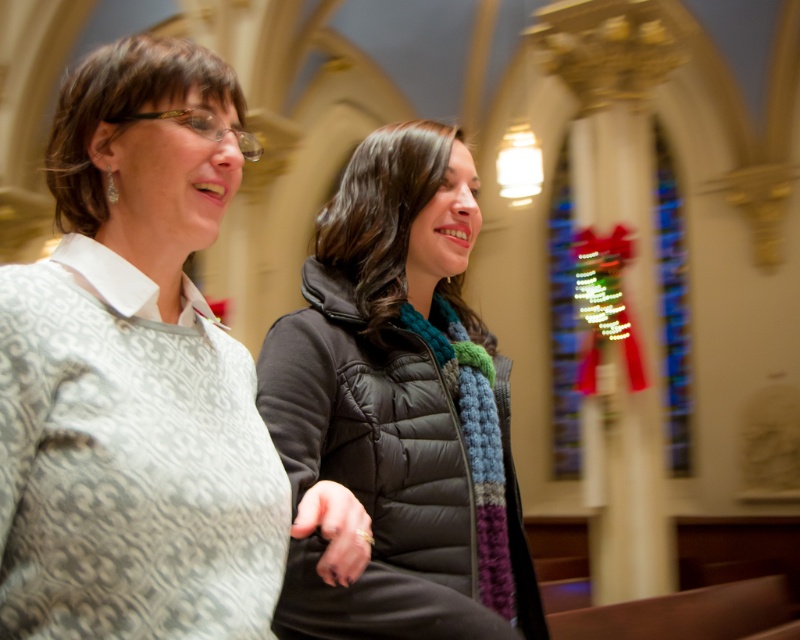
Which is more to the right, patterned fabric shirt at left or black quilted jacket at center?

Positioned to the right is black quilted jacket at center.

Which is in front, point (82, 372) or point (364, 273)?

Point (82, 372) is in front.

Is point (4, 593) positioned before point (292, 333)?

That is True.

At what (x,y) coordinates should I click in order to perform the action: click on patterned fabric shirt at left. Please return your answer as a coordinate pair (x, y). The width and height of the screenshot is (800, 640). Looking at the image, I should click on (134, 372).